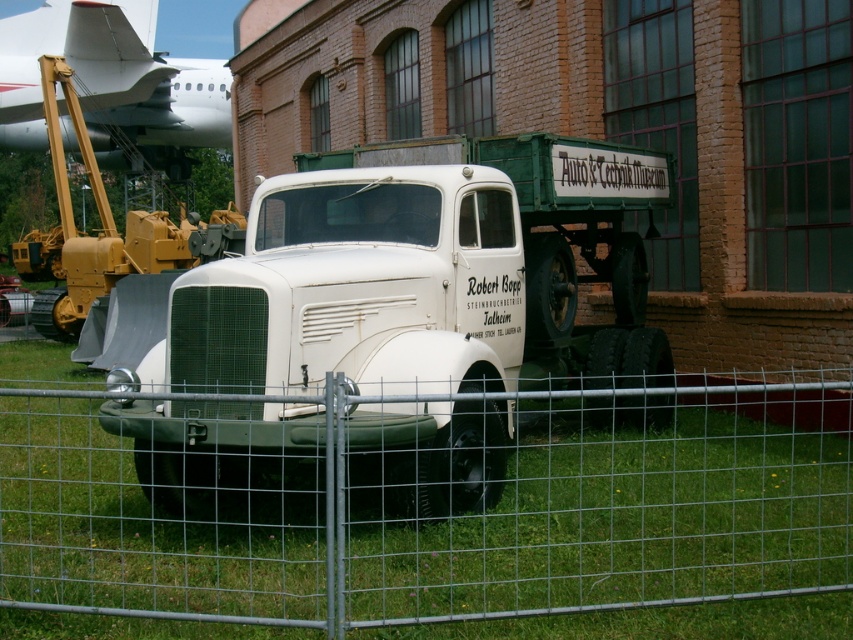
Who is more distant from viewer, (476, 349) or (151, 218)?

The point (151, 218) is behind.

Between point (483, 458) and point (154, 220), which one is positioned in front?

Positioned in front is point (483, 458).

Identify the location of white matte trailer truck at center. (392, 320).

Does white glossy airplane at upper left come behind white matte truck at center?

Yes, it is.

Who is more forward, (93, 33) or (84, 312)?

Point (84, 312) is in front.

Locate an element on the screen. Image resolution: width=853 pixels, height=640 pixels. white glossy airplane at upper left is located at coordinates (113, 77).

This screenshot has height=640, width=853. In order to click on green grass at lower center in this screenshot , I will do `click(440, 518)`.

Between point (781, 444) and point (97, 316), which one is positioned in front?

Positioned in front is point (781, 444).

At what (x,y) coordinates should I click in order to perform the action: click on green grass at lower center. Please return your answer as a coordinate pair (x, y). The image size is (853, 640). Looking at the image, I should click on (440, 518).